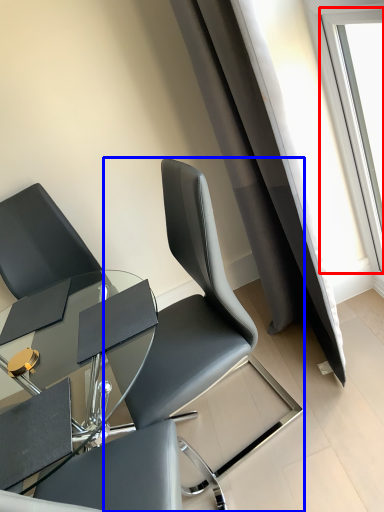
Question: Among these objects, which one is nearest to the camera, window (highlighted by a red box) or chair (highlighted by a blue box)?

Choices:
 (A) window
 (B) chair

Answer: (B)